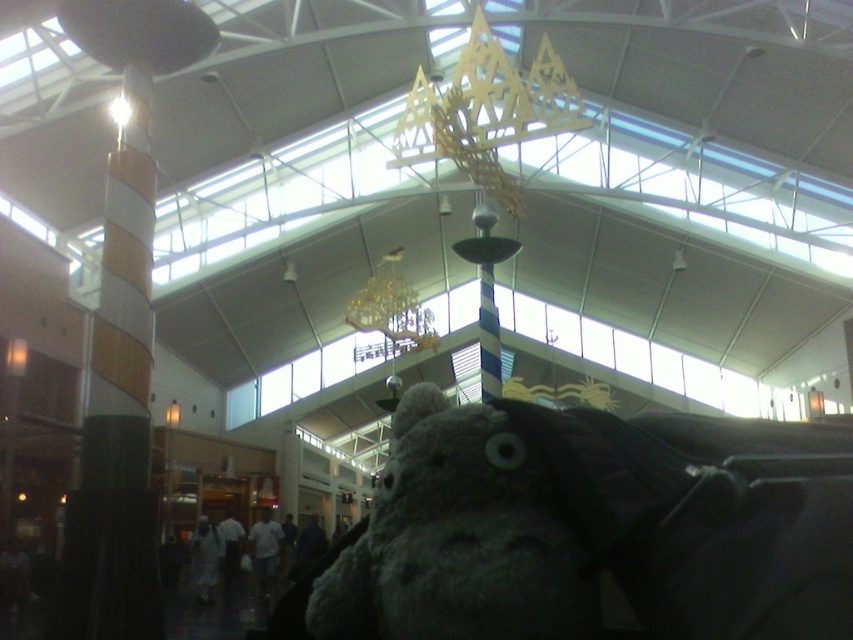
Is gray plush toy at center wider than striped wood pillar at left?

No.

Between gray plush toy at center and striped wood pillar at left, which one is positioned higher?

striped wood pillar at left is higher up.

The image size is (853, 640). What are the coordinates of `gray plush toy at center` in the screenshot? It's located at (596, 528).

The image size is (853, 640). In order to click on gray plush toy at center in this screenshot , I will do `click(596, 528)`.